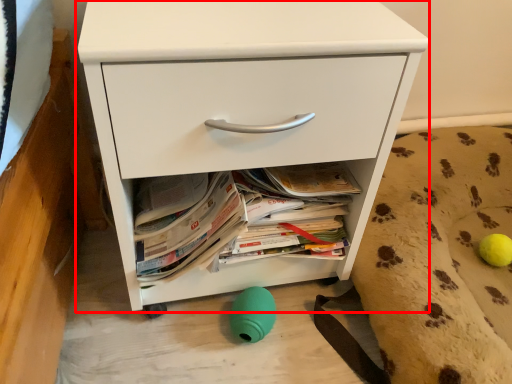
Question: Where is chest of drawers (annotated by the red box) located in relation to dog bed in the image?

Choices:
 (A) left
 (B) right

Answer: (A)